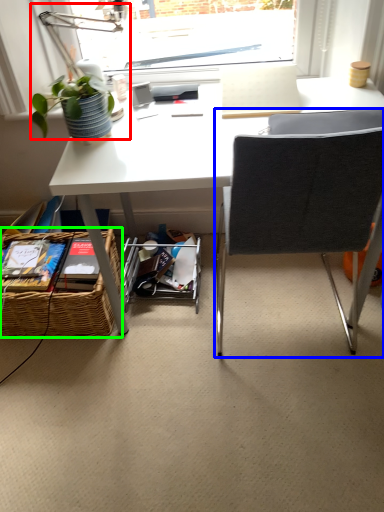
Question: Considering the real-world distances, which object is farthest from table lamp (highlighted by a red box)? chair (highlighted by a blue box) or picnic basket (highlighted by a green box)?

Choices:
 (A) chair
 (B) picnic basket

Answer: (A)